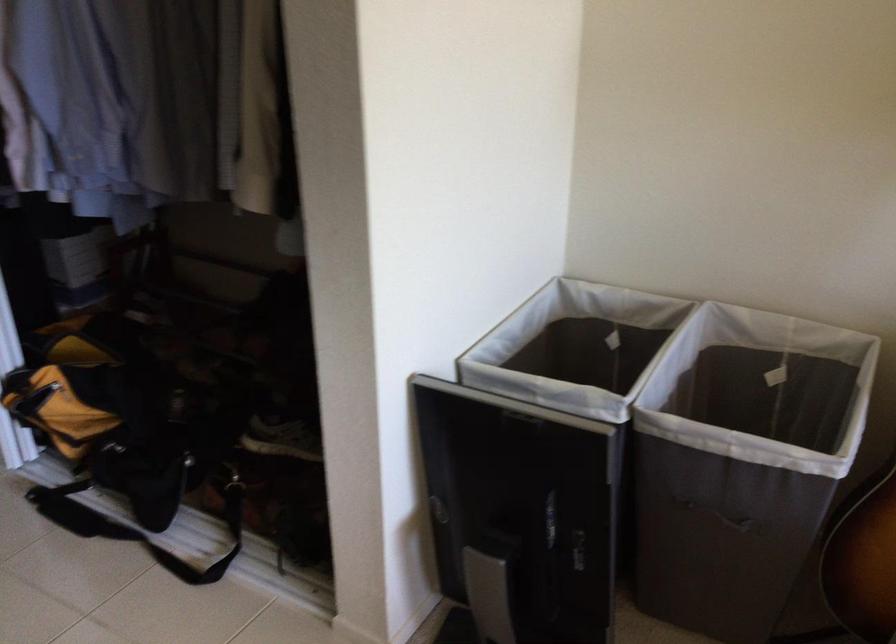
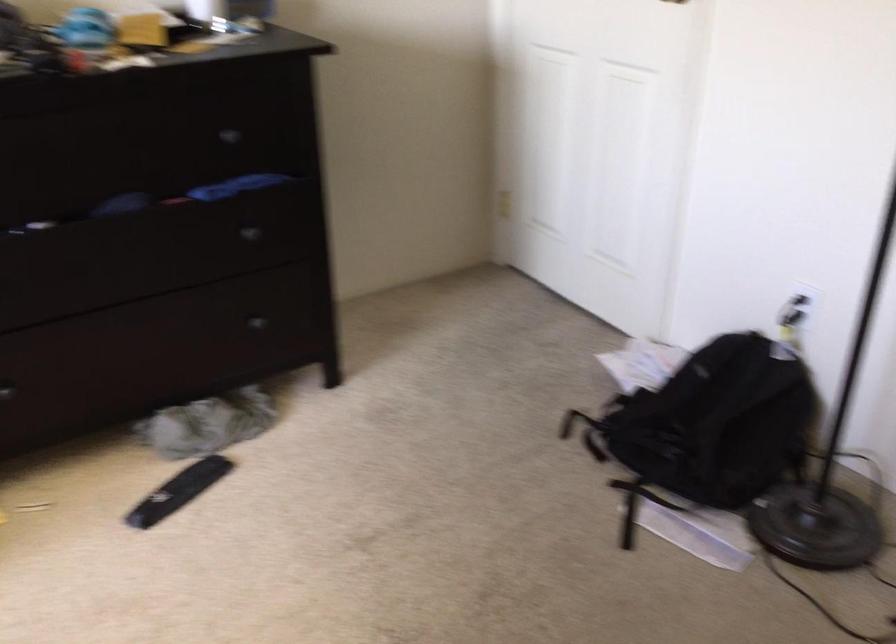
Based on the continuous images, in which direction is the camera rotating?

The rotation direction of the camera is left-down.